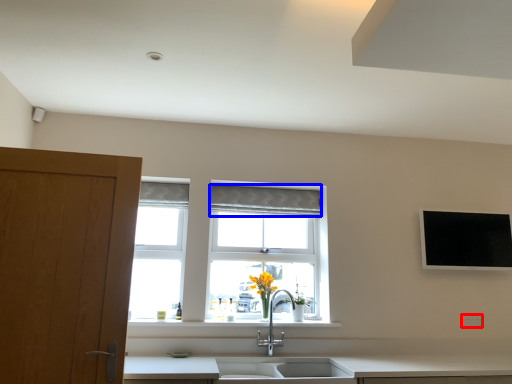
Question: Which point is closer to the camera, electric outlet (highlighted by a red box) or curtain (highlighted by a blue box)?

Choices:
 (A) electric outlet
 (B) curtain

Answer: (A)